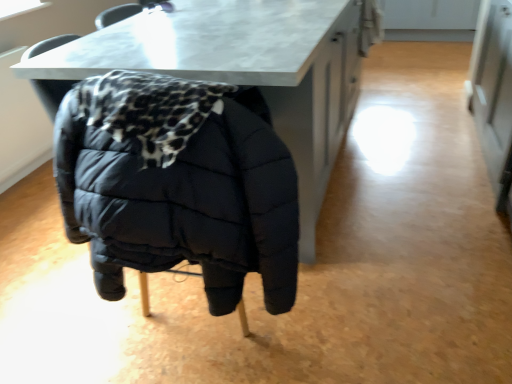
Where is `free space below matte black puffer jacket at center (from a real-world perspective)`? The height and width of the screenshot is (384, 512). free space below matte black puffer jacket at center (from a real-world perspective) is located at coordinates (184, 308).